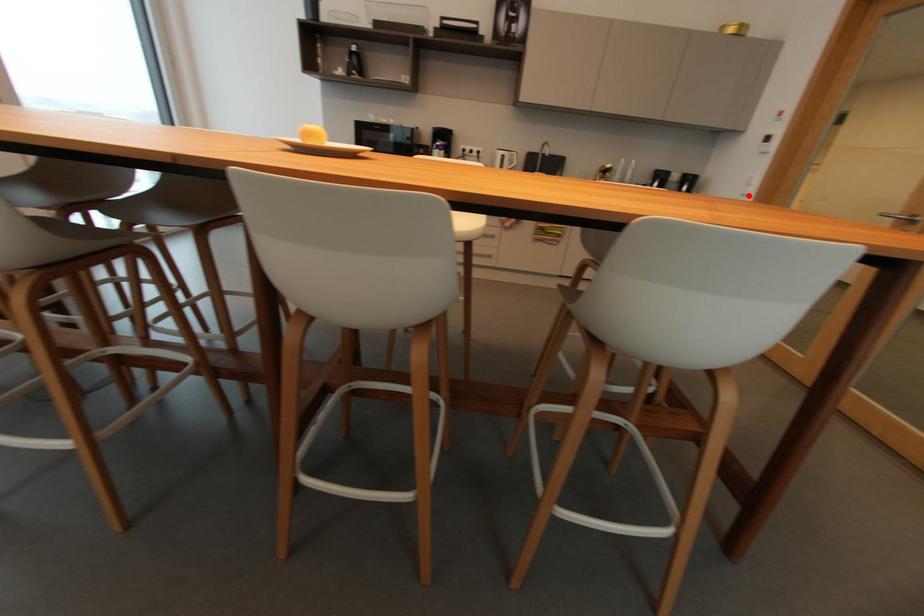
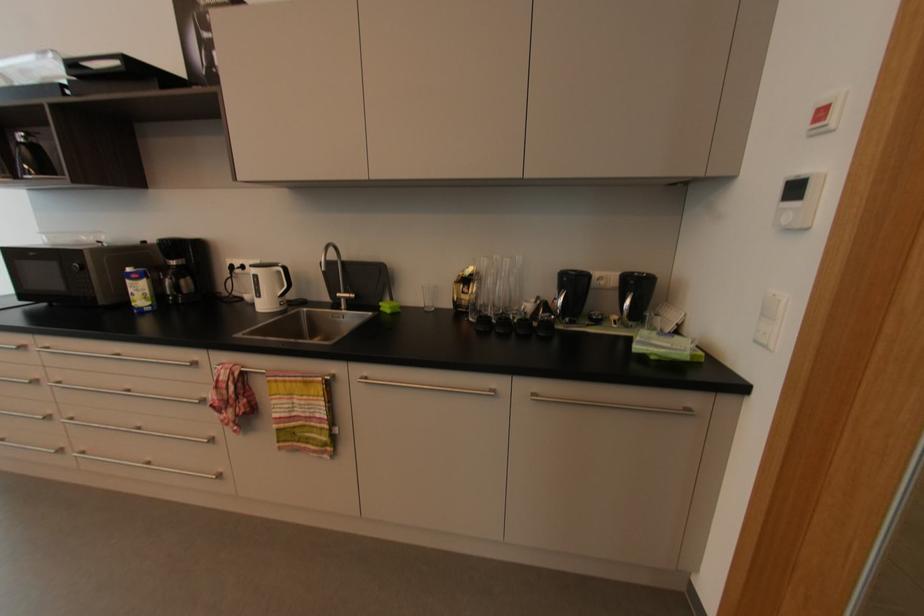
Locate, in the second image, the point that corresponds to the highlighted location in the first image.

(769, 347)